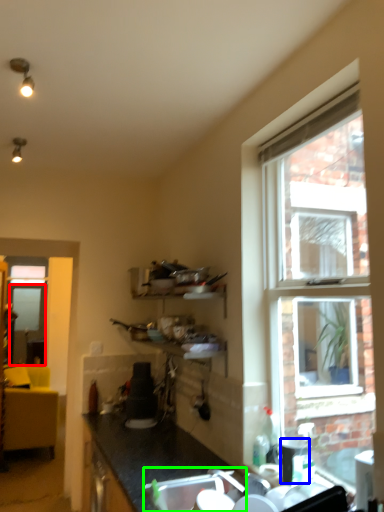
Question: Considering the real-world distances, which object is farthest from screen door (highlighted by a red box)? appliance (highlighted by a blue box) or sink (highlighted by a green box)?

Choices:
 (A) appliance
 (B) sink

Answer: (A)